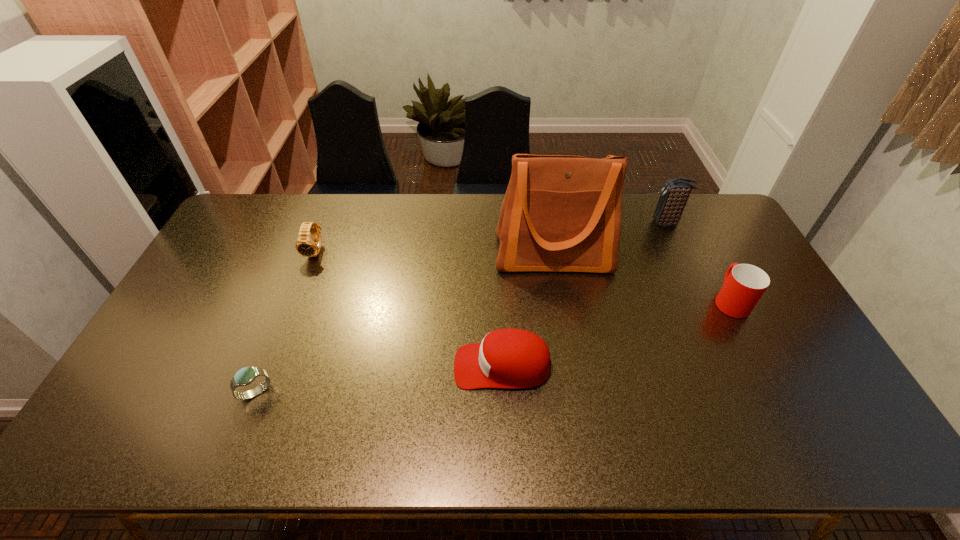
Where is `free location located with the zip open on the farthest object`? free location located with the zip open on the farthest object is located at coordinates (598, 224).

Where is `vacant space located 0.290m with the zip open on the farthest object`? vacant space located 0.290m with the zip open on the farthest object is located at coordinates (570, 224).

You are a GUI agent. You are given a task and a screenshot of the screen. Output one action in this format:
    pyautogui.click(x=<x>, y=<y>)
    Task: Click on the free location located on the side of the third nearest object with the handle
    The width and height of the screenshot is (960, 540).
    Given the screenshot: What is the action you would take?
    pyautogui.click(x=703, y=247)

The width and height of the screenshot is (960, 540). Identify the location of blank space located on the side of the third nearest object with the handle. (705, 251).

Locate an element on the screen. This screenshot has height=540, width=960. vacant region located on the side of the third nearest object with the handle is located at coordinates (704, 249).

At what (x,y) coordinates should I click in order to perform the action: click on blank space located on the face of the taller watch. Please return your answer as a coordinate pair (x, y). This screenshot has width=960, height=540. Looking at the image, I should click on (287, 328).

Where is `free space located on the front-facing side of the baseball cap`? This screenshot has height=540, width=960. free space located on the front-facing side of the baseball cap is located at coordinates (398, 366).

The height and width of the screenshot is (540, 960). What are the coordinates of `free space located 0.050m on the front-facing side of the baseball cap` in the screenshot? It's located at (436, 366).

The height and width of the screenshot is (540, 960). What are the coordinates of `vacant space situated on the front-facing side of the baseball cap` in the screenshot? It's located at (342, 366).

Where is `vacant region located 0.320m on the right of the shorter watch`? This screenshot has height=540, width=960. vacant region located 0.320m on the right of the shorter watch is located at coordinates (398, 392).